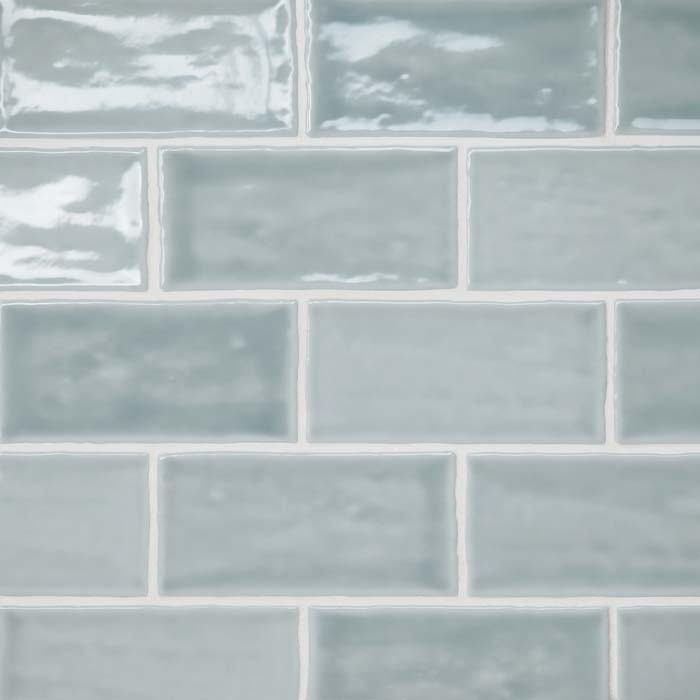
Where is `top right tile`? top right tile is located at coordinates (658, 35).